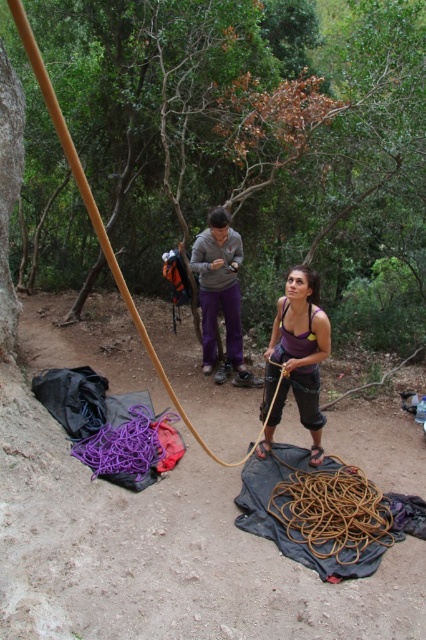
Can you confirm if purple fabric tank top at center is taller than matte gray hoodie at center?

Incorrect, purple fabric tank top at center's height is not larger of matte gray hoodie at center's.

Between purple fabric tank top at center and matte gray hoodie at center, which one has more height?

matte gray hoodie at center

Locate an element on the screen. The height and width of the screenshot is (640, 426). purple fabric tank top at center is located at coordinates (296, 358).

Between brown rope at lower center and purple fabric tank top at center, which one appears on the right side from the viewer's perspective?

brown rope at lower center

Between brown rope at lower center and purple fabric tank top at center, which one is positioned higher?

purple fabric tank top at center is higher up.

The height and width of the screenshot is (640, 426). What do you see at coordinates (331, 509) in the screenshot? I see `brown rope at lower center` at bounding box center [331, 509].

You are a GUI agent. You are given a task and a screenshot of the screen. Output one action in this format:
    pyautogui.click(x=<x>, y=<y>)
    Task: Click on the brown rope at lower center
    
    Given the screenshot: What is the action you would take?
    pyautogui.click(x=331, y=509)

Which is above, brown wood pole at center or brown rope at lower center?

brown wood pole at center is higher up.

Does point (256, 157) lie in front of point (319, 524)?

No, (256, 157) is further to viewer.

Find the location of a particular element. brown wood pole at center is located at coordinates (311, 125).

You are a GUI agent. You are given a task and a screenshot of the screen. Output one action in this format:
    pyautogui.click(x=<x>, y=<y>)
    Task: Click on the brown wood pole at center
    This screenshot has width=426, height=640.
    Given the screenshot: What is the action you would take?
    pyautogui.click(x=311, y=125)